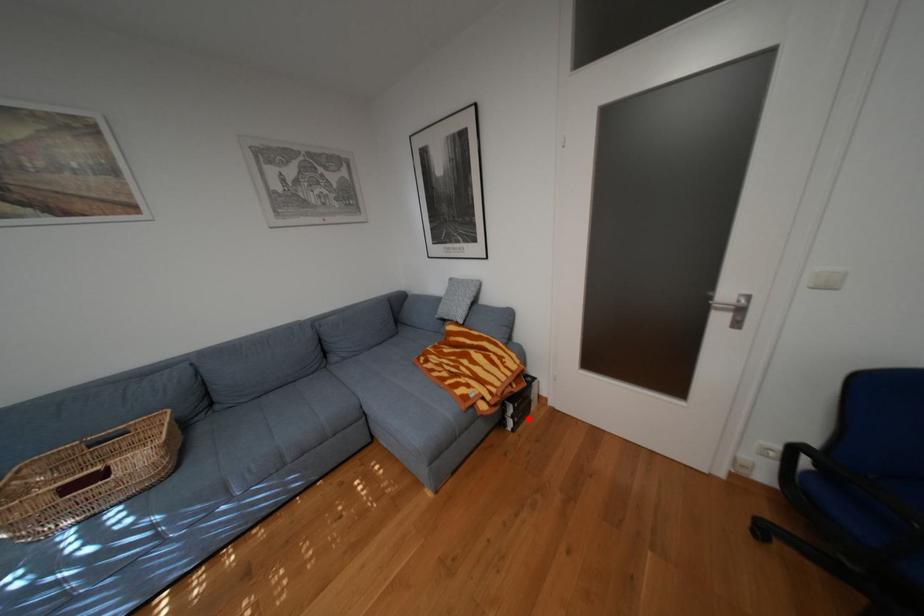
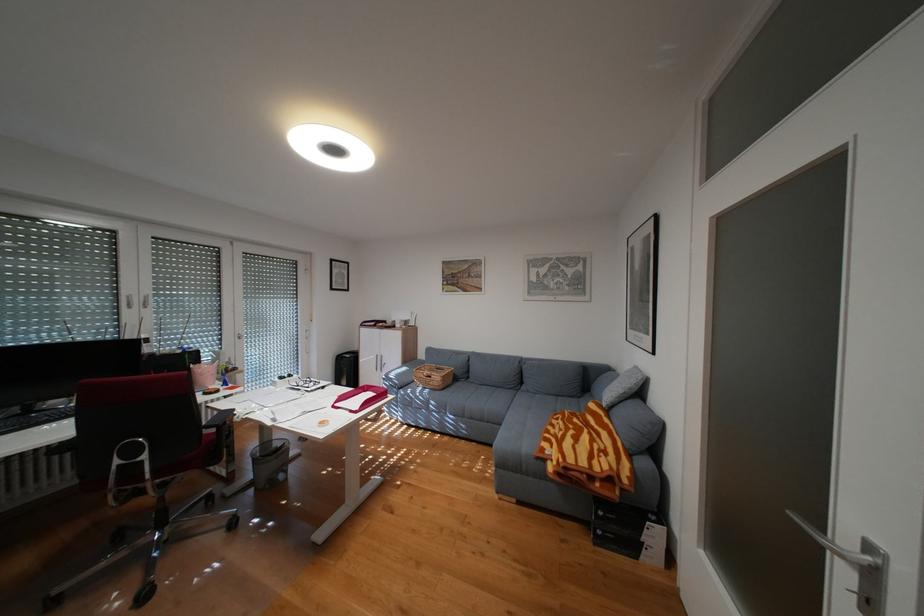
Question: I am providing you with two images of the same scene from different viewpoints. Image1 has a red point marked. In image2, the corresponding 3D location appears at what relative position? Reply with the corresponding letter.

Choices:
 (A) Closer
 (B) Farther

Answer: (A)